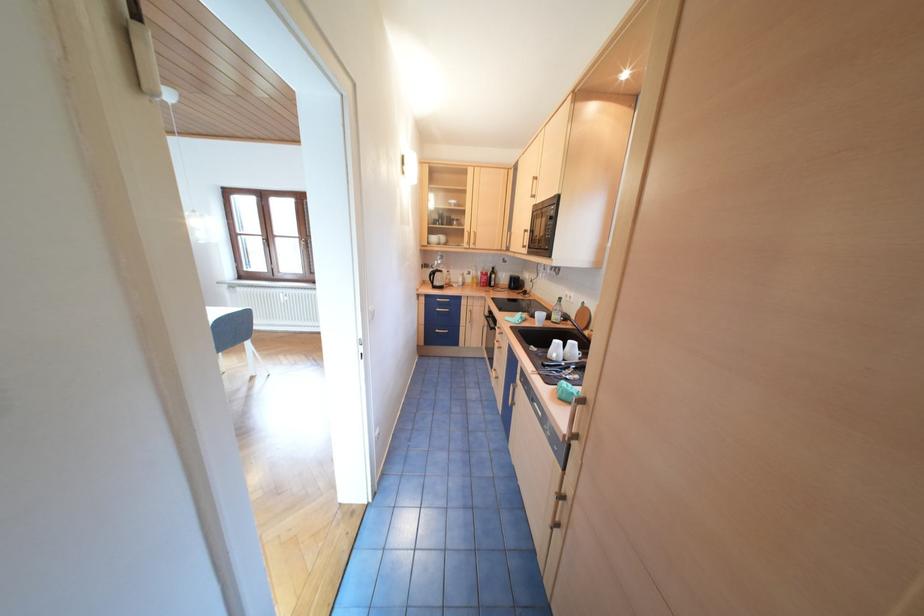
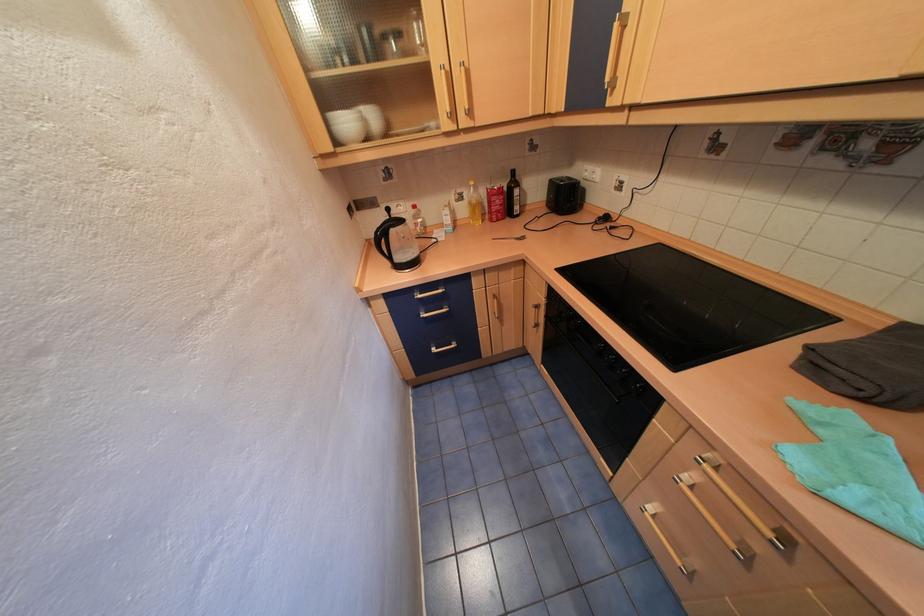
Where in the second image is the point corresponding to (479,280) from the first image?

(472, 211)